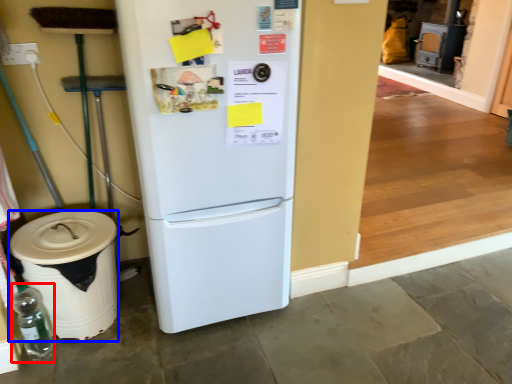
Question: Which object is closer to the camera taking this photo, bottle (highlighted by a red box) or trash bin/can (highlighted by a blue box)?

Choices:
 (A) bottle
 (B) trash bin/can

Answer: (B)